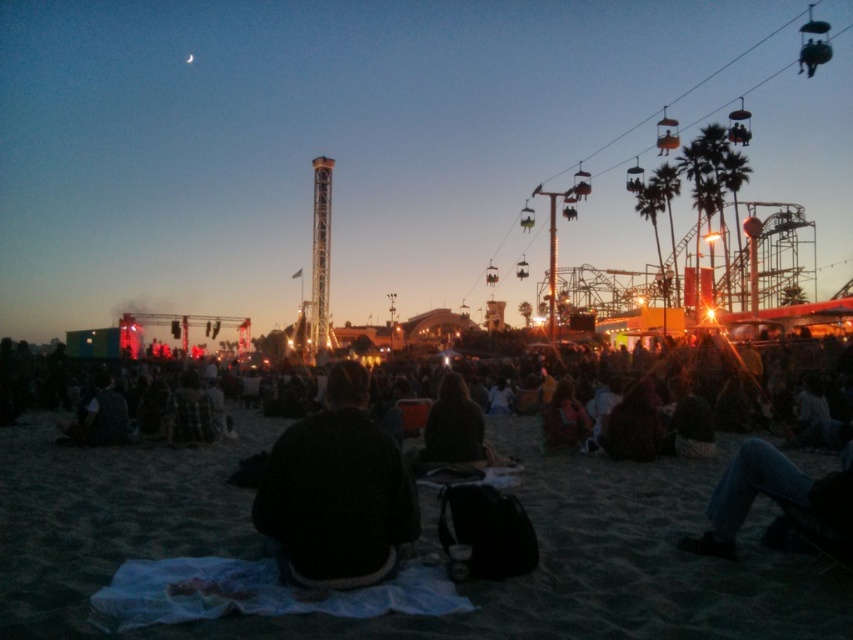
You are at the beach festival and see two sweaters, the black sweater at center and the dark brown sweater at center. Which one is positioned to the left?

The black sweater at center is positioned to the left of the dark brown sweater at center.

You are standing at the beach festival and see two sweaters, the black sweater at center and the dark brown sweater at center. Which one is nearer to you?

The black sweater at center is closer to the viewer than the dark brown sweater at center.